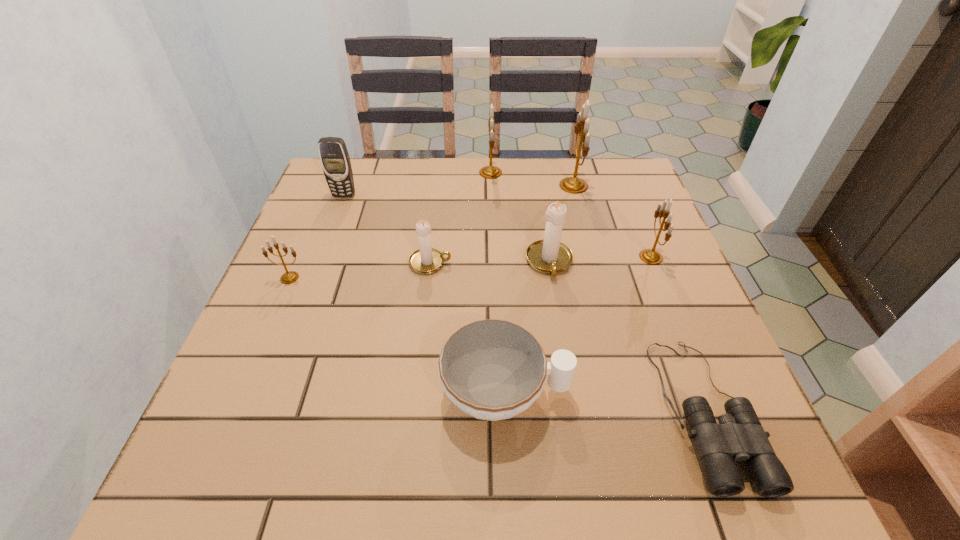
At what (x,y) coordinates should I click in order to perform the action: click on the tallest candle holder. Please return your answer as a coordinate pair (x, y). The height and width of the screenshot is (540, 960). Looking at the image, I should click on (575, 185).

Image resolution: width=960 pixels, height=540 pixels. I want to click on the third gold candelabrum from left to right, so click(x=575, y=185).

Locate an element on the screen. This screenshot has height=540, width=960. the second tallest object is located at coordinates (490, 172).

Where is `the third candle holder from left to right`? The height and width of the screenshot is (540, 960). the third candle holder from left to right is located at coordinates (490, 172).

Locate an element on the screen. cellular telephone is located at coordinates (334, 157).

Find the location of a particular element. the bigger white candle holder is located at coordinates (549, 255).

Locate an element on the screen. the right white candle holder is located at coordinates (549, 255).

The width and height of the screenshot is (960, 540). I want to click on the rightmost gold candelabrum, so click(651, 256).

The height and width of the screenshot is (540, 960). What are the coordinates of `the rightmost candle holder` in the screenshot? It's located at (651, 256).

Find the location of `the smallest gold candelabrum`. the smallest gold candelabrum is located at coordinates (289, 277).